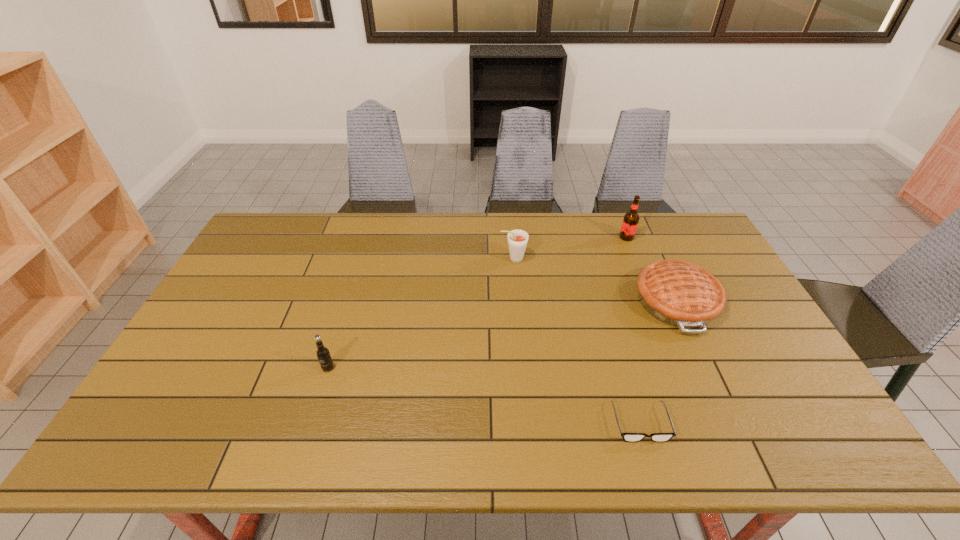
I want to click on vacant area that lies between the third object from left to right and the second nearest object, so click(484, 395).

What are the coordinates of `unoccupied area between the tallest object and the fourth object from right to left` in the screenshot? It's located at (570, 248).

Identify the location of free space that is in between the leftmost root beer and the second farthest object. Image resolution: width=960 pixels, height=540 pixels. (420, 313).

Where is `empty location between the nearest object and the nearest root beer`? Image resolution: width=960 pixels, height=540 pixels. empty location between the nearest object and the nearest root beer is located at coordinates (484, 395).

This screenshot has width=960, height=540. In order to click on the third closest object relative to the fourth object from right to left in this screenshot , I will do pyautogui.click(x=628, y=437).

Select which object is the second closest to the tallest root beer. Please provide its 2D coordinates. Your answer should be formatted as a tuple, i.e. [(x, y)], where the tuple contains the x and y coordinates of a point satisfying the conditions above.

[(517, 239)]

The height and width of the screenshot is (540, 960). Find the location of `root beer that is the nearest to the spectacles`. root beer that is the nearest to the spectacles is located at coordinates (517, 239).

Identify which root beer is the third nearest to the third object from left to right. Please provide its 2D coordinates. Your answer should be formatted as a tuple, i.e. [(x, y)], where the tuple contains the x and y coordinates of a point satisfying the conditions above.

[(323, 354)]

Locate an element on the screen. Image resolution: width=960 pixels, height=540 pixels. free spot that satisfies the following two spatial constraints: 1. on the back side of the second shortest object; 2. on the drink side of the second nearest root beer is located at coordinates (657, 259).